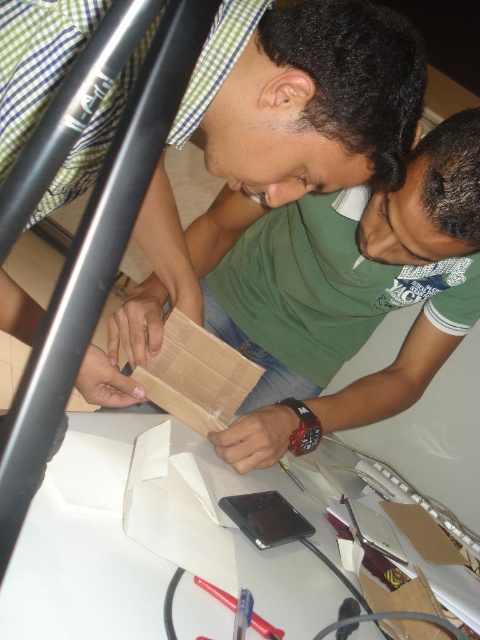
You are organizing a workshop and need to place a new item between the green matte shirt at center and the metallic silver pen at lower center. Based on their positions, where should you place the new item?

The new item should be placed between the green matte shirt at center and the metallic silver pen at lower center, as the green matte shirt at center is to the left of the metallic silver pen at lower center.

You are standing at the point marked as point [247,80]. You want to reach the smartphone on the table without moving your feet. Can you reach it?

The point [247,80] is 20.75 inches away from the viewer. Since the smartphone is on the table, which is within arm reach, you can likely reach it without moving your feet.